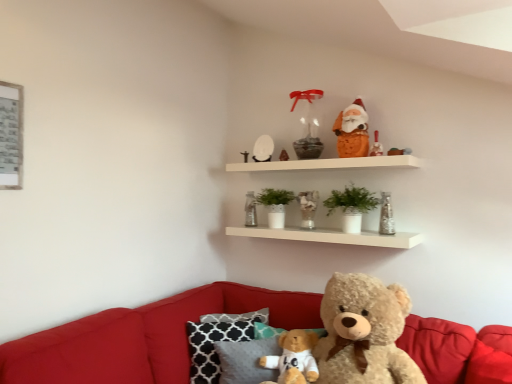
Describe the element at coordinates (330, 235) in the screenshot. I see `white glossy shelves at upper center` at that location.

Measure the distance between point (347,205) and camera.

They are 2.46 meters apart.

What do you see at coordinates (376, 146) in the screenshot? This screenshot has height=384, width=512. I see `translucent glass candle at upper center, the second toy viewed from the right` at bounding box center [376, 146].

This screenshot has width=512, height=384. Find the location of `metallic silver picture frame at upper left`. metallic silver picture frame at upper left is located at coordinates (11, 136).

This screenshot has height=384, width=512. What do you see at coordinates (11, 136) in the screenshot?
I see `metallic silver picture frame at upper left` at bounding box center [11, 136].

The image size is (512, 384). What do you see at coordinates (142, 337) in the screenshot?
I see `velvet red couch at lower center` at bounding box center [142, 337].

This screenshot has width=512, height=384. In order to click on white glossy shelves at upper center in this screenshot , I will do `click(330, 235)`.

From a real-world perspective, is translucent glass vase at upper center, which is counted as the 3th toy, starting from the right, over green matte plant at center, which ranks as the second plant in right-to-left order?

Actually, translucent glass vase at upper center, which is counted as the 3th toy, starting from the right, is physically below green matte plant at center, which ranks as the second plant in right-to-left order, in the real world.

Does translucent glass vase at upper center, which ranks as the 5th toy in left-to-right order, lie in front of green matte plant at center, which ranks as the second plant in right-to-left order?

Yes, the depth of translucent glass vase at upper center, which ranks as the 5th toy in left-to-right order, is less than that of green matte plant at center, which ranks as the second plant in right-to-left order.

From the image's perspective, between translucent glass vase at upper center, which ranks as the 5th toy in left-to-right order, and green matte plant at center, which is counted as the second plant, starting from the front, which one is located above?

green matte plant at center, which is counted as the second plant, starting from the front, is shown above in the image.

From a real-world perspective, is translucent glass candle at upper center below white glossy shelves at upper center?

No, from a real-world perspective, translucent glass candle at upper center is not below white glossy shelves at upper center.

In terms of width, does translucent glass candle at upper center look wider or thinner when compared to white glossy shelves at upper center?

Clearly, translucent glass candle at upper center has less width compared to white glossy shelves at upper center.

From the image's perspective, is translucent glass candle at upper center over white glossy shelves at upper center?

Yes, from the image's perspective, translucent glass candle at upper center is on top of white glossy shelves at upper center.

Is the depth of translucent glass candle at upper center less than that of white glossy shelves at upper center?

No, translucent glass candle at upper center is behind white glossy shelves at upper center.

This screenshot has width=512, height=384. Identify the location of the 5th toy positioned below the orange plush santa at upper center (from the image's perspective). (386, 215).

Is point (385, 211) farther from camera compared to point (361, 129)?

Yes, point (385, 211) is behind point (361, 129).

From a real-world perspective, between clear glass vase at upper center, the 7th toy positioned from the left, and orange plush santa at upper center, who is vertically lower?

clear glass vase at upper center, the 7th toy positioned from the left, is physically lower.

Which object is thinner, clear glass vase at upper center, which appears as the first toy when viewed from the right, or orange plush santa at upper center?

With smaller width is clear glass vase at upper center, which appears as the first toy when viewed from the right.

Would you say white glossy shelves at upper center is a long distance from translucent glass vase at upper center, which is counted as the 3th toy, starting from the right?

No, white glossy shelves at upper center is not far away from translucent glass vase at upper center, which is counted as the 3th toy, starting from the right.

This screenshot has width=512, height=384. Find the location of `shelf on the right of the translucent glass vase at upper center, which ranks as the 5th toy in left-to-right order`. shelf on the right of the translucent glass vase at upper center, which ranks as the 5th toy in left-to-right order is located at coordinates (330, 235).

Between white glossy shelves at upper center and translucent glass vase at upper center, which is counted as the 3th toy, starting from the right, which one has less height?

With less height is translucent glass vase at upper center, which is counted as the 3th toy, starting from the right.

Is point (226, 168) in front of point (309, 197)?

No, it is not.

Is point (199, 290) closer or farther from the camera than point (345, 204)?

Clearly, point (199, 290) is closer to the camera than point (345, 204).

In the image, is velvet red couch at lower center positioned in front of or behind green matte plant at center, the 1th plant when ordered from right to left?

velvet red couch at lower center is in front of green matte plant at center, the 1th plant when ordered from right to left.

Who is smaller, velvet red couch at lower center or green matte plant at center, the 1th plant viewed from the front?

green matte plant at center, the 1th plant viewed from the front, is smaller.

Does velvet red couch at lower center have a lesser height compared to green matte plant at center, the 1th plant viewed from the front?

In fact, velvet red couch at lower center may be taller than green matte plant at center, the 1th plant viewed from the front.

From the image's perspective, between translucent glass candle at upper center, the second toy viewed from the right, and matte white candle at upper center, the fourth toy from the right, who is located below?

matte white candle at upper center, the fourth toy from the right, appears lower in the image.

Is the depth of translucent glass candle at upper center, marked as the 6th toy in a left-to-right arrangement, less than that of matte white candle at upper center, which is counted as the fourth toy, starting from the left?

Yes, it is.

Considering the sizes of translucent glass candle at upper center, marked as the 6th toy in a left-to-right arrangement, and matte white candle at upper center, the fourth toy from the right, in the image, is translucent glass candle at upper center, marked as the 6th toy in a left-to-right arrangement, taller or shorter than matte white candle at upper center, the fourth toy from the right,?

Considering their sizes, translucent glass candle at upper center, marked as the 6th toy in a left-to-right arrangement, has more height than matte white candle at upper center, the fourth toy from the right.

From a real-world perspective, which object rests below the other?

matte white candle at upper center, which is counted as the fourth toy, starting from the left.

Who is taller, orange plush santa at upper center or matte white candle at upper center, the fourth toy from the right?

Standing taller between the two is orange plush santa at upper center.

From the image's perspective, between orange plush santa at upper center and matte white candle at upper center, the fourth toy from the right, which one is located above?

From the image's view, orange plush santa at upper center is above.

Considering the positions of point (342, 121) and point (284, 151), is point (342, 121) closer or farther from the camera than point (284, 151)?

Clearly, point (342, 121) is closer to the camera than point (284, 151).

The image size is (512, 384). I want to click on plant behind the translucent glass vase at upper center, which ranks as the 5th toy in left-to-right order, so click(x=275, y=205).

Image resolution: width=512 pixels, height=384 pixels. Identify the location of shelf in front of the translucent glass candle at upper center. (330, 235).

Considering their positions, is metallic silver candlestick at upper center, acting as the first toy starting from the left, positioned further to orange plush santa at upper center than white glossy shelves at upper center?

Based on the image, metallic silver candlestick at upper center, acting as the first toy starting from the left, appears to be further to orange plush santa at upper center.

Estimate the real-world distances between objects in this image. Which object is closer to metallic silver picture frame at upper left, white glossy egg at upper center, marked as the fifth toy in a right-to-left arrangement, or metallic silver vase at upper center, which appears as the 2th toy when viewed from the left?

white glossy egg at upper center, marked as the fifth toy in a right-to-left arrangement.

When comparing their distances from velvet red couch at lower center, does white glossy egg at upper center, arranged as the third toy when viewed from the left, or green matte plant at center, the 1th plant viewed from the front, seem further?

Based on the image, white glossy egg at upper center, arranged as the third toy when viewed from the left, appears to be further to velvet red couch at lower center.

Based on their spatial positions, is green matte plant at center, acting as the 1th plant starting from the left, or translucent glass candle at upper center closer to white glossy shelves at upper center?

The object closer to white glossy shelves at upper center is green matte plant at center, acting as the 1th plant starting from the left.

Estimate the real-world distances between objects in this image. Which object is further from orange plush santa at upper center, translucent glass vase at upper center, which ranks as the 5th toy in left-to-right order, or translucent glass candle at upper center?

Among the two, translucent glass vase at upper center, which ranks as the 5th toy in left-to-right order, is located further to orange plush santa at upper center.

When comparing their distances from clear glass vase at upper center, which appears as the first toy when viewed from the right, does metallic silver picture frame at upper left or velvet red couch at lower center seem closer?

velvet red couch at lower center is positioned closer to the anchor clear glass vase at upper center, which appears as the first toy when viewed from the right.

From the image, which object appears to be nearer to white glossy shelves at upper center, white glossy egg at upper center, arranged as the third toy when viewed from the left, or translucent glass candle at upper center, the second toy viewed from the right?

white glossy egg at upper center, arranged as the third toy when viewed from the left, is positioned closer to the anchor white glossy shelves at upper center.

Looking at the image, which one is located further to green matte plant at center, the 1th plant viewed from the front, metallic silver picture frame at upper left or translucent glass candle at upper center?

metallic silver picture frame at upper left.

Where is `figurine between velvet red couch at lower center and metallic silver vase at upper center, the sixth toy positioned from the right, along the z-axis`? This screenshot has height=384, width=512. figurine between velvet red couch at lower center and metallic silver vase at upper center, the sixth toy positioned from the right, along the z-axis is located at coordinates tap(308, 126).

Where is `plant between velvet red couch at lower center and translucent glass vase at upper center, which ranks as the 5th toy in left-to-right order, along the z-axis`? plant between velvet red couch at lower center and translucent glass vase at upper center, which ranks as the 5th toy in left-to-right order, along the z-axis is located at coordinates (351, 200).

This screenshot has width=512, height=384. In order to click on shelf between metallic silver candlestick at upper center, acting as the first toy starting from the left, and clear glass vase at upper center, which appears as the first toy when viewed from the right in this screenshot , I will do `click(330, 235)`.

This screenshot has height=384, width=512. I want to click on figurine located between white glossy shelves at upper center and white glossy egg at upper center, arranged as the third toy when viewed from the left, in the depth direction, so click(x=308, y=126).